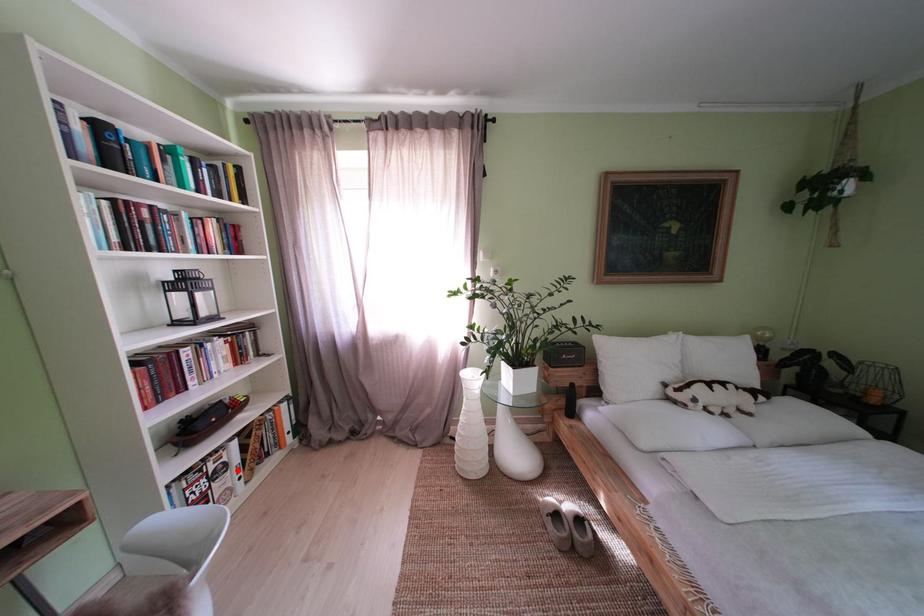
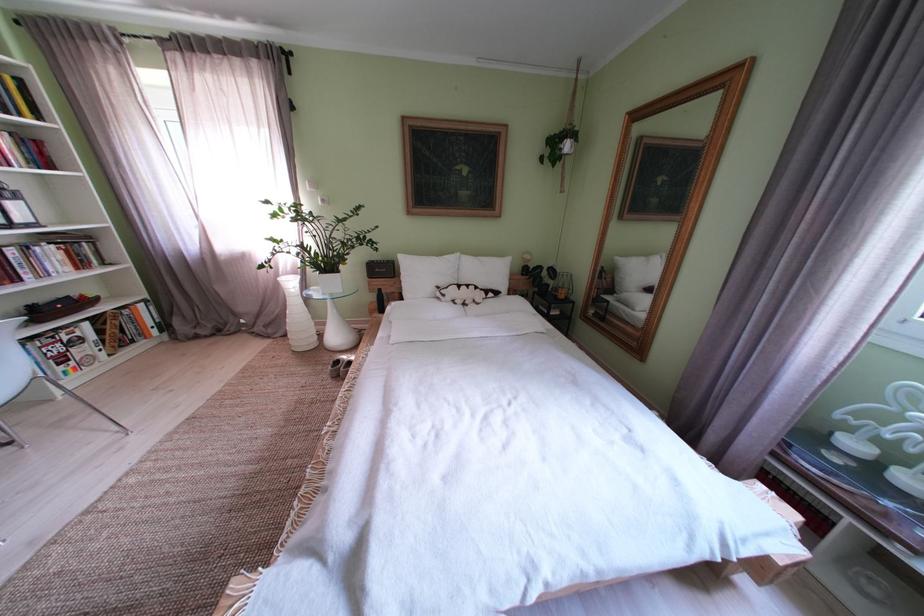
Find the pixel in the second image that matches the highlighted location in the first image.

(92, 344)